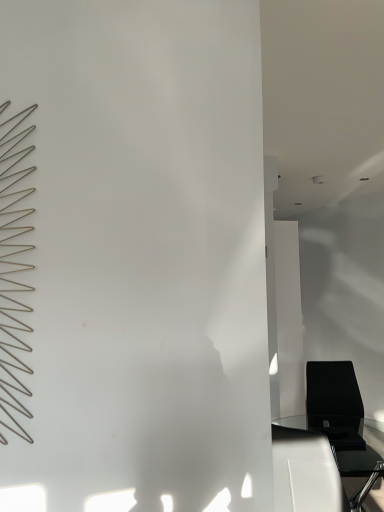
The image size is (384, 512). I want to click on black leather chair at lower right, so click(x=342, y=422).

Image resolution: width=384 pixels, height=512 pixels. What do you see at coordinates (342, 422) in the screenshot? I see `black leather chair at lower right` at bounding box center [342, 422].

Locate an element on the screen. The height and width of the screenshot is (512, 384). black leather chair at lower right is located at coordinates (342, 422).